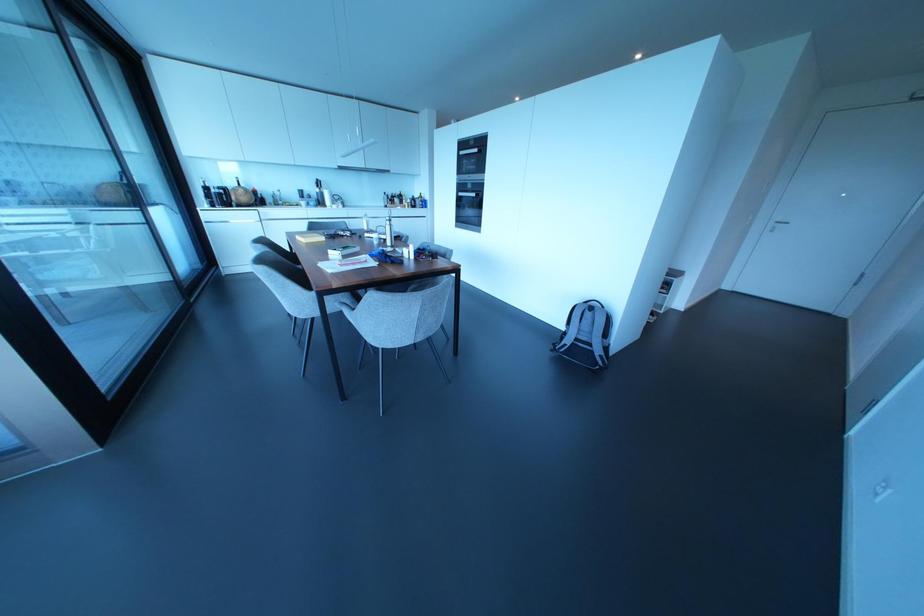
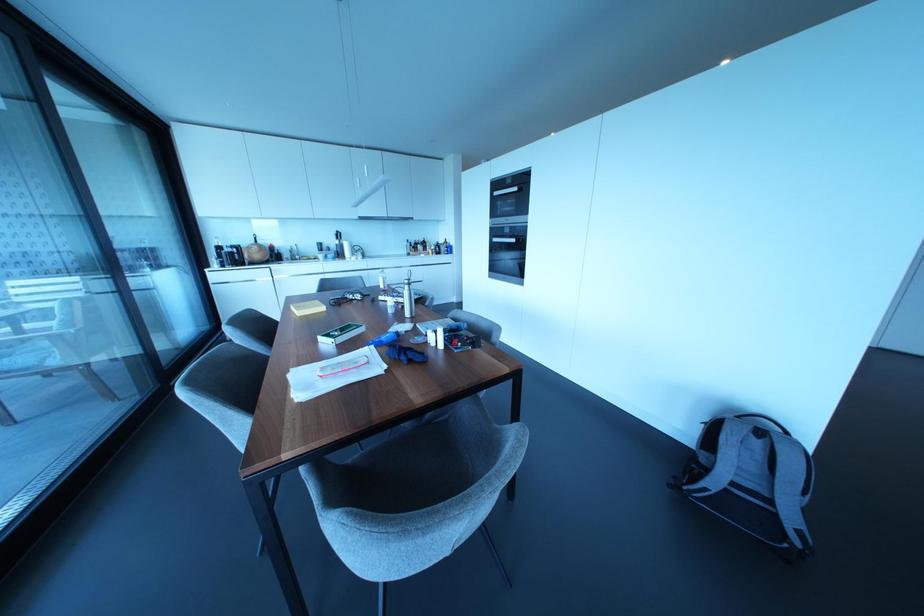
Find the pixel in the second image that matches pixel 387 222 in the first image.

(406, 286)